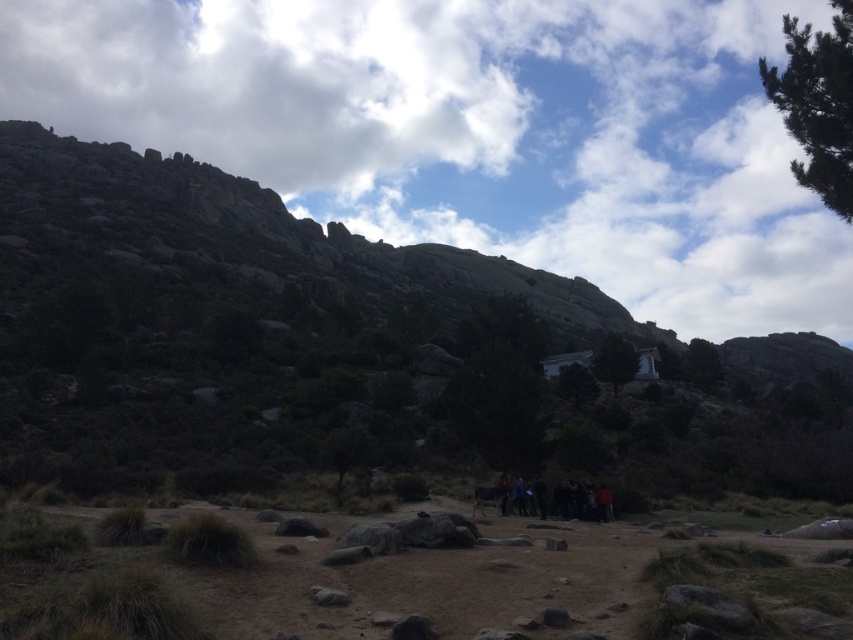
Which is more to the left, white fluffy cloud at upper center or rocky at center?

Positioned to the left is rocky at center.

Based on the photo, who is shorter, white fluffy cloud at upper center or rocky at center?

Standing shorter between the two is rocky at center.

Between point (694, 192) and point (399, 420), which one is positioned behind?

Point (694, 192)

At what (x,y) coordinates should I click in order to perform the action: click on white fluffy cloud at upper center. Please return your answer as a coordinate pair (x, y). This screenshot has width=853, height=640. Looking at the image, I should click on (477, 132).

Does rocky at center have a smaller size compared to dark clothing group at center?

Actually, rocky at center might be larger than dark clothing group at center.

Who is positioned more to the left, rocky at center or dark clothing group at center?

Positioned to the left is rocky at center.

Locate an element on the screen. Image resolution: width=853 pixels, height=640 pixels. rocky at center is located at coordinates (257, 324).

Consider the image. Measure the distance from white fluffy cloud at upper center to dark clothing group at center.

421.52 meters

Is white fluffy cloud at upper center thinner than dark clothing group at center?

Incorrect, white fluffy cloud at upper center's width is not less than dark clothing group at center's.

Does point (660, 216) come farther from viewer compared to point (595, 509)?

Yes.

What are the coordinates of `white fluffy cloud at upper center` in the screenshot? It's located at (477, 132).